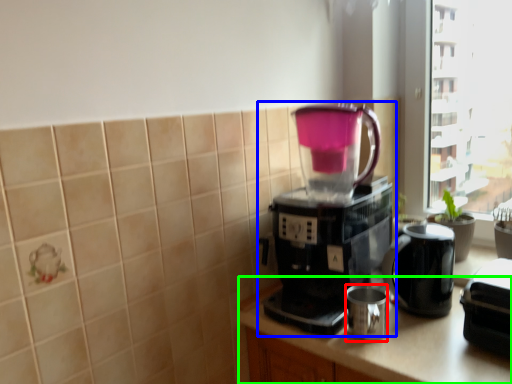
Question: Which object is positioned farthest from mug (highlighted by a red box)? Select from coffee maker (highlighted by a blue box) and counter top (highlighted by a green box).

Choices:
 (A) coffee maker
 (B) counter top

Answer: (A)